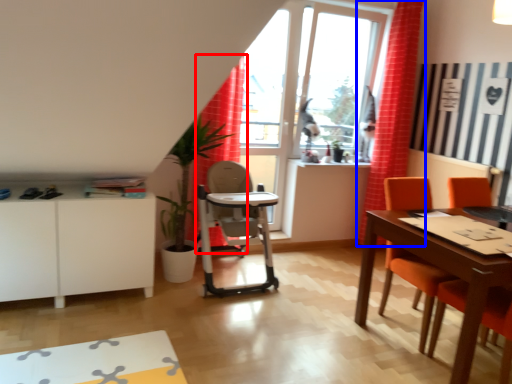
Question: Which of the following is the farthest to the observer, curtain (highlighted by a red box) or curtain (highlighted by a blue box)?

Choices:
 (A) curtain
 (B) curtain

Answer: (B)